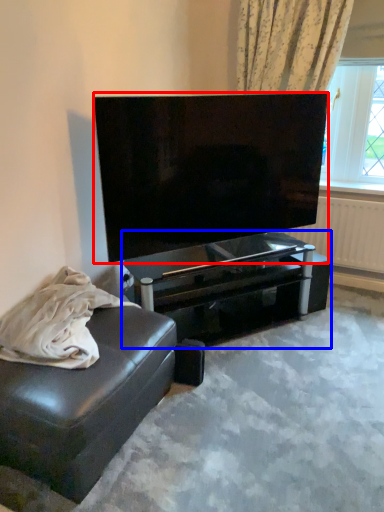
Question: Which point is further to the camera, television (highlighted by a red box) or table (highlighted by a blue box)?

Choices:
 (A) television
 (B) table

Answer: (B)